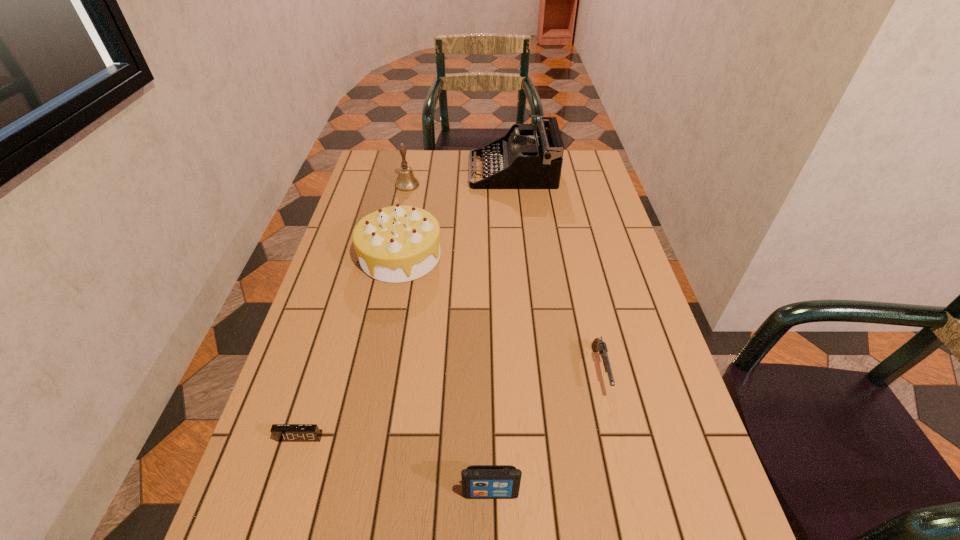
You are a GUI agent. You are given a task and a screenshot of the screen. Output one action in this format:
    pyautogui.click(x=<x>, y=<y>)
    Task: Click on the vacant space that's between the birthday cake and the fifth farthest object
    Image resolution: width=960 pixels, height=540 pixels.
    Given the screenshot: What is the action you would take?
    pyautogui.click(x=350, y=346)

You are a GUI agent. You are given a task and a screenshot of the screen. Output one action in this format:
    pyautogui.click(x=<x>, y=<y>)
    Task: Click on the vacant area that lies between the typewriter and the gun
    
    Given the screenshot: What is the action you would take?
    pyautogui.click(x=556, y=271)

Find the location of `unoccupied position between the second shortest object and the fourth tallest object`. unoccupied position between the second shortest object and the fourth tallest object is located at coordinates (545, 431).

At what (x,y) coordinates should I click in order to perform the action: click on vacant space that is in between the bell and the fifth farthest object. Please return your answer as a coordinate pair (x, y). Image resolution: width=960 pixels, height=540 pixels. Looking at the image, I should click on (353, 310).

The width and height of the screenshot is (960, 540). I want to click on vacant space in between the bell and the typewriter, so 460,178.

Where is `free spot between the birthday cake and the second nearest object`? free spot between the birthday cake and the second nearest object is located at coordinates (350, 346).

The image size is (960, 540). What are the coordinates of `vacant area between the bell and the gun` in the screenshot? It's located at (504, 278).

You are a GUI agent. You are given a task and a screenshot of the screen. Output one action in this format:
    pyautogui.click(x=<x>, y=<y>)
    Task: Click on the free point between the bell and the typewriter
    This screenshot has height=540, width=960.
    Given the screenshot: What is the action you would take?
    pyautogui.click(x=460, y=178)

Locate an element on the screen. empty space that is in between the nearest object and the bell is located at coordinates click(449, 339).

At what (x,y) coordinates should I click in order to perform the action: click on object that is the second closest one to the shortest object. Please return your answer as a coordinate pair (x, y). This screenshot has height=540, width=960. Looking at the image, I should click on (395, 244).